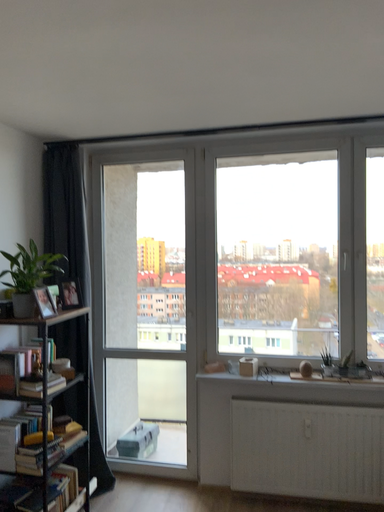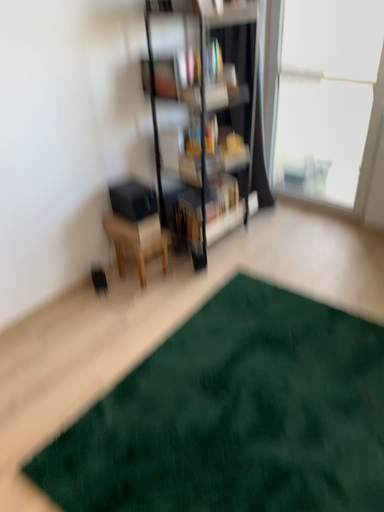
Question: How did the camera likely rotate when shooting the video?

Choices:
 (A) rotated left
 (B) rotated right

Answer: (A)